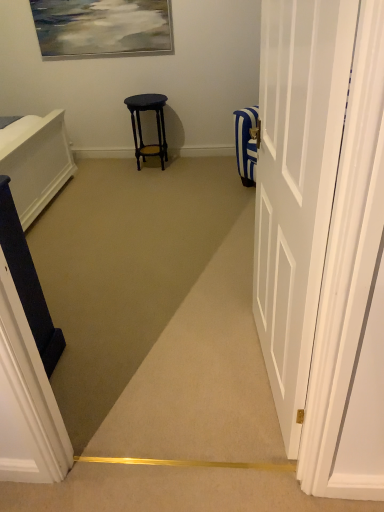
Question: From the image's perspective, is white glossy door at right on top of dark blue fabric at left?

Choices:
 (A) yes
 (B) no

Answer: (A)

Question: From a real-world perspective, is white glossy door at right under dark blue fabric at left?

Choices:
 (A) no
 (B) yes

Answer: (A)

Question: Is white glossy door at right to the left of dark blue fabric at left from the viewer's perspective?

Choices:
 (A) yes
 (B) no

Answer: (B)

Question: Can you confirm if white glossy door at right is taller than dark blue fabric at left?

Choices:
 (A) no
 (B) yes

Answer: (B)

Question: From the image's perspective, is white glossy door at right under dark blue fabric at left?

Choices:
 (A) yes
 (B) no

Answer: (B)

Question: Is white glossy door at right facing towards dark blue fabric at left?

Choices:
 (A) no
 (B) yes

Answer: (B)

Question: From the image's perspective, is matte black stool at center below white glossy door at right?

Choices:
 (A) no
 (B) yes

Answer: (A)

Question: Is matte black stool at center bigger than white glossy door at right?

Choices:
 (A) yes
 (B) no

Answer: (B)

Question: Is matte black stool at center behind white glossy door at right?

Choices:
 (A) yes
 (B) no

Answer: (A)

Question: Can you confirm if matte black stool at center is thinner than white glossy door at right?

Choices:
 (A) yes
 (B) no

Answer: (B)

Question: Does matte black stool at center have a smaller size compared to white glossy door at right?

Choices:
 (A) yes
 (B) no

Answer: (A)

Question: Is matte black stool at center in front of white glossy door at right?

Choices:
 (A) no
 (B) yes

Answer: (A)

Question: From a real-world perspective, is white glossy door at right under matte black stool at center?

Choices:
 (A) no
 (B) yes

Answer: (A)